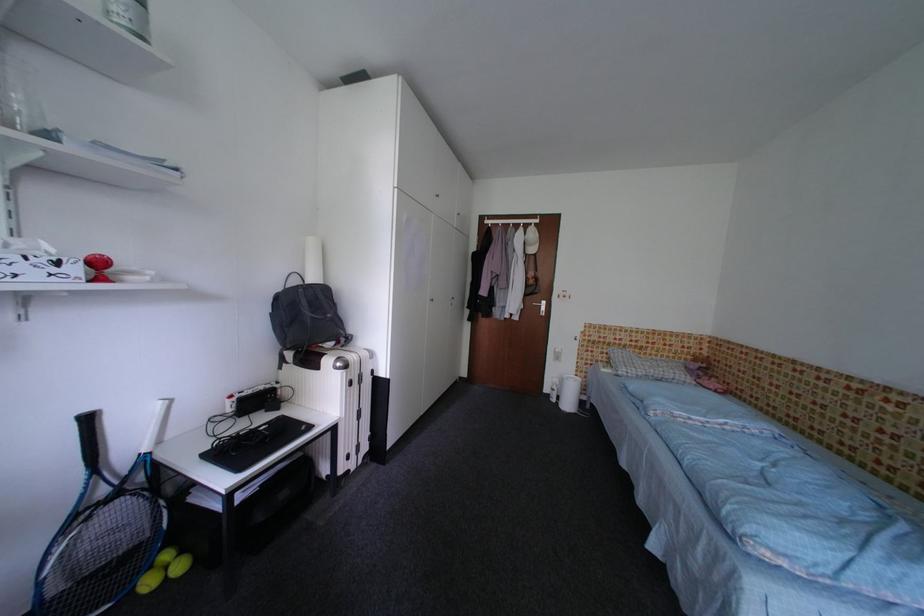
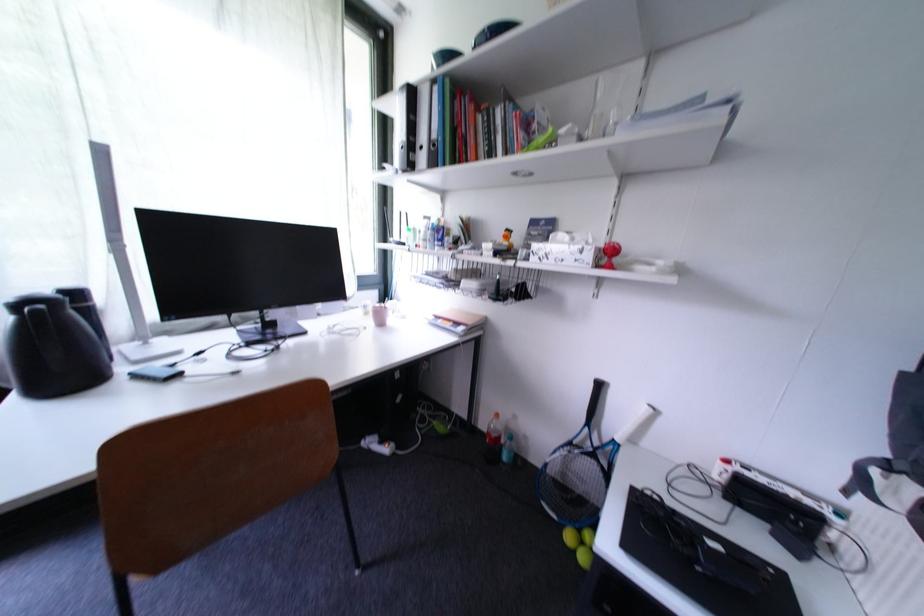
Question: I am providing you with two images of the same scene from different viewpoints. After the viewpoint changes to image2, which objects are now occluded?

Choices:
 (A) black bottle crate
 (B) yellow tennis ball
 (C) green ring binder
 (D) white tissue box

Answer: (B)